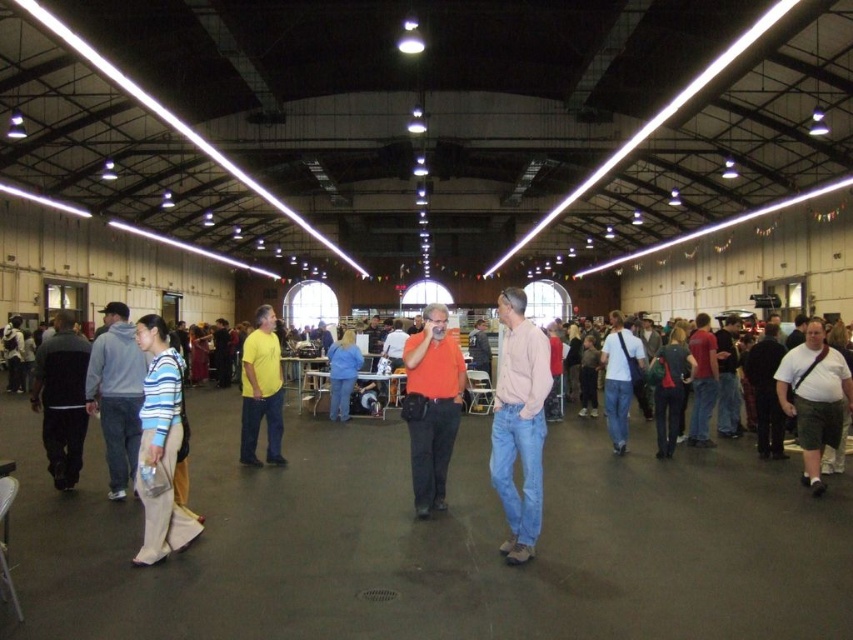
You are a photographer positioned at the entrance of the warehouse and want to capture both the pink cotton shirt at center and the dark gray backpack at center right in a single frame. Which object should you focus on first to ensure both are in the frame?

You should focus on the pink cotton shirt at center first because it is taller than the dark gray backpack at center right, ensuring it stays within the frame while adjusting for the backpack.

You are organizing a photo shoot in the warehouse and need to ensure that the pink cotton shirt at center and the dark gray backpack at center right are visible in the frame. Which object should you focus on to capture both items without cropping either?

To capture both the pink cotton shirt at center and the dark gray backpack at center right without cropping, focus on the pink cotton shirt at center since it is wider. This ensures the backpack, which is narrower, will also fit into the frame.